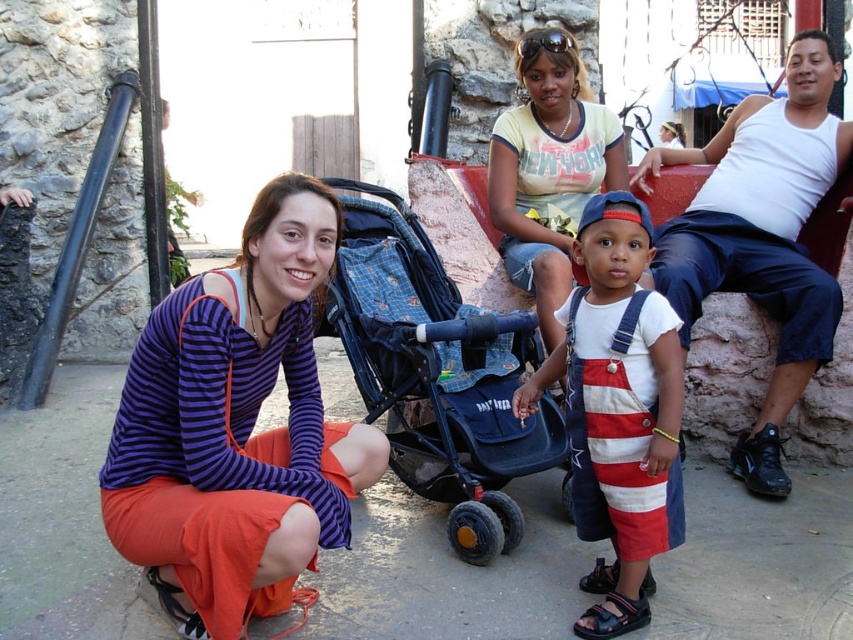
You are a photographer trying to capture a photo of the purple striped shirt at lower left and the blue fabric stroller at center. Which object should you focus on first if you want to ensure both are in focus without adjusting your camera settings?

The purple striped shirt at lower left is shorter than the blue fabric stroller at center, so you should focus on the blue fabric stroller at center first to ensure both are in focus.

You are taking a photo of two points in the scene. The first point is at coordinates point (619,506) and the second point is at point (625,604). Which point will appear larger in your photo?

Point (619,506) will appear larger in the photo because it is closer to the camera than point (625,604).